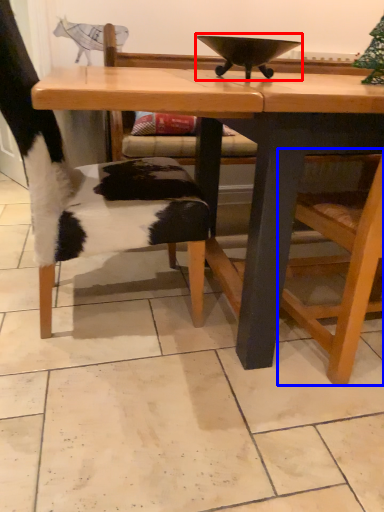
Question: Which object is closer to the camera taking this photo, bowl (highlighted by a red box) or armchair (highlighted by a blue box)?

Choices:
 (A) bowl
 (B) armchair

Answer: (B)